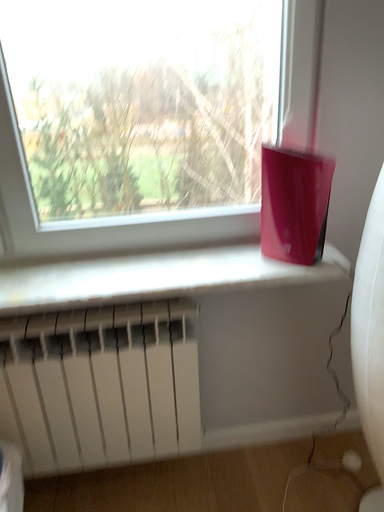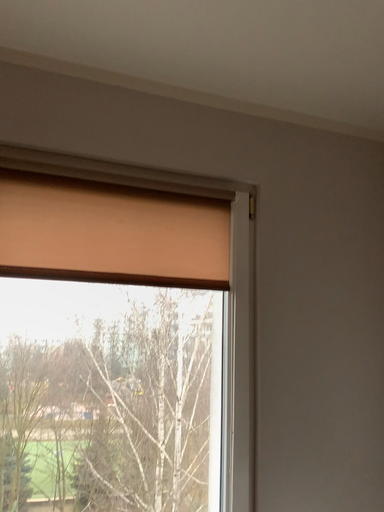
Question: Which way did the camera rotate in the video?

Choices:
 (A) rotated right
 (B) rotated left

Answer: (A)